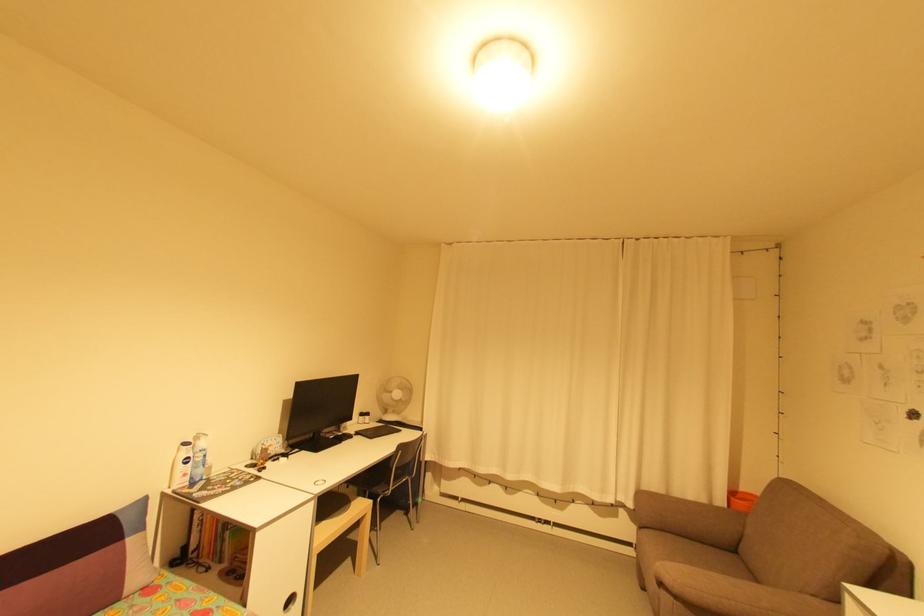
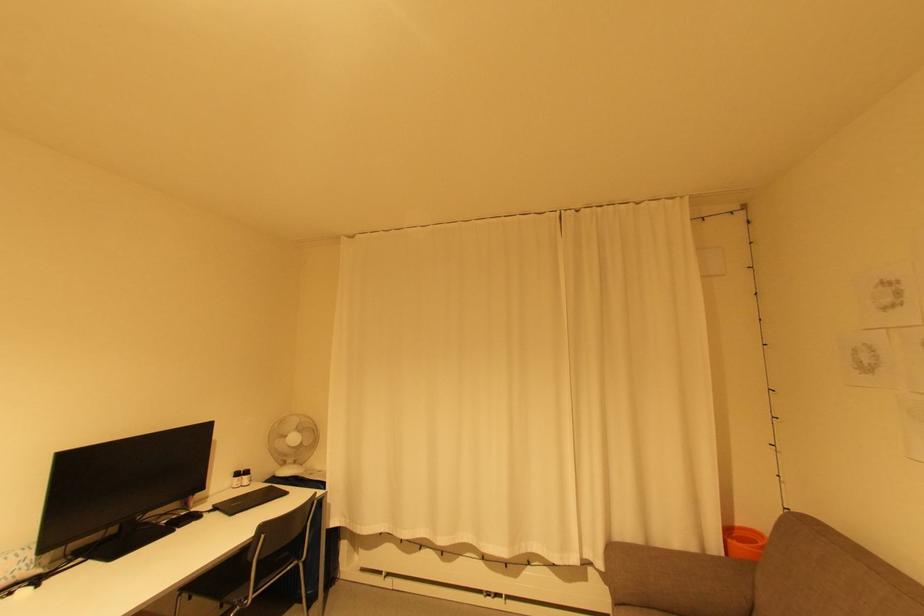
Find the pixel in the second image that matches point (371, 418) in the first image.

(250, 477)